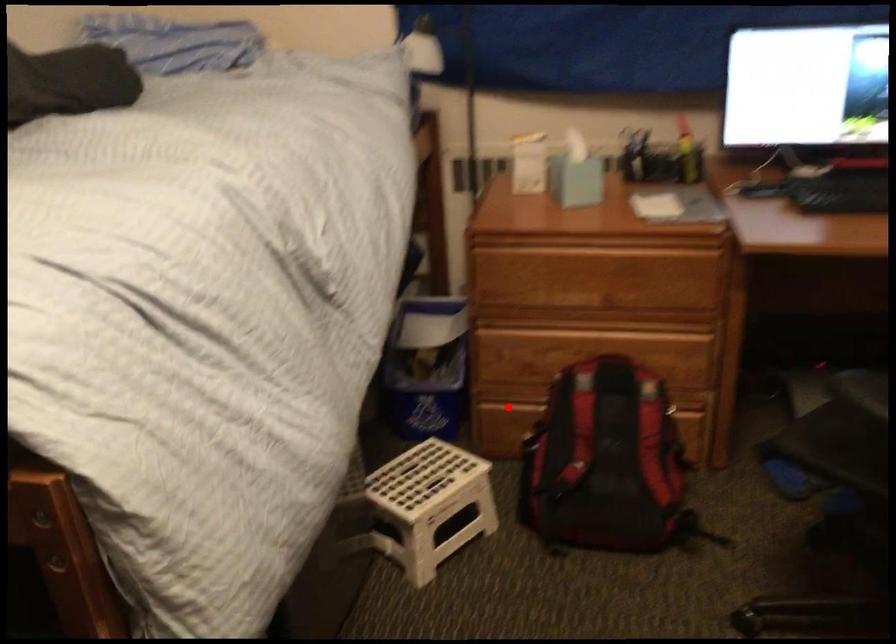
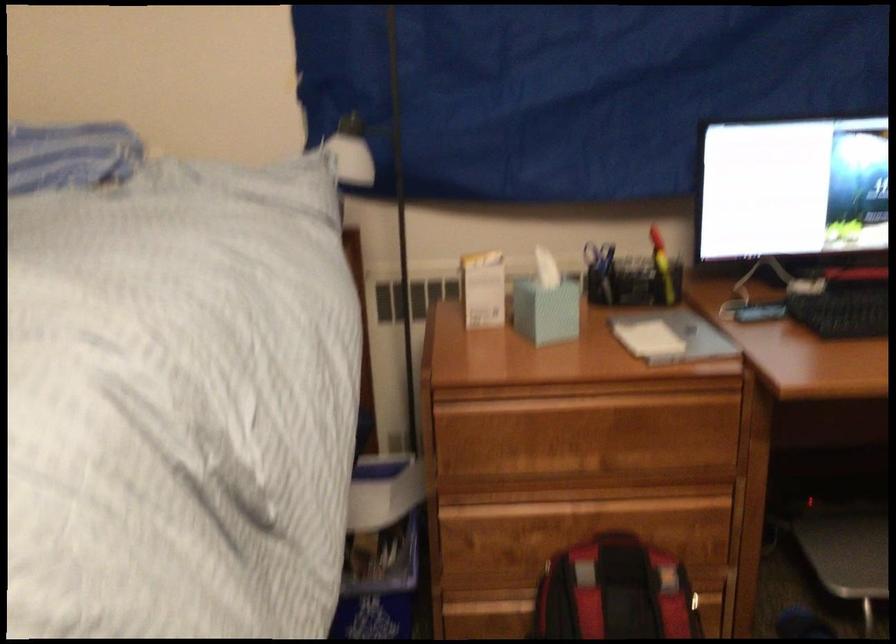
Question: I am providing you with two images of the same scene from different viewpoints. Given a red point in image1, look at the same physical point in image2. Is it:

Choices:
 (A) Closer to the viewpoint
 (B) Farther from the viewpoint

Answer: (A)